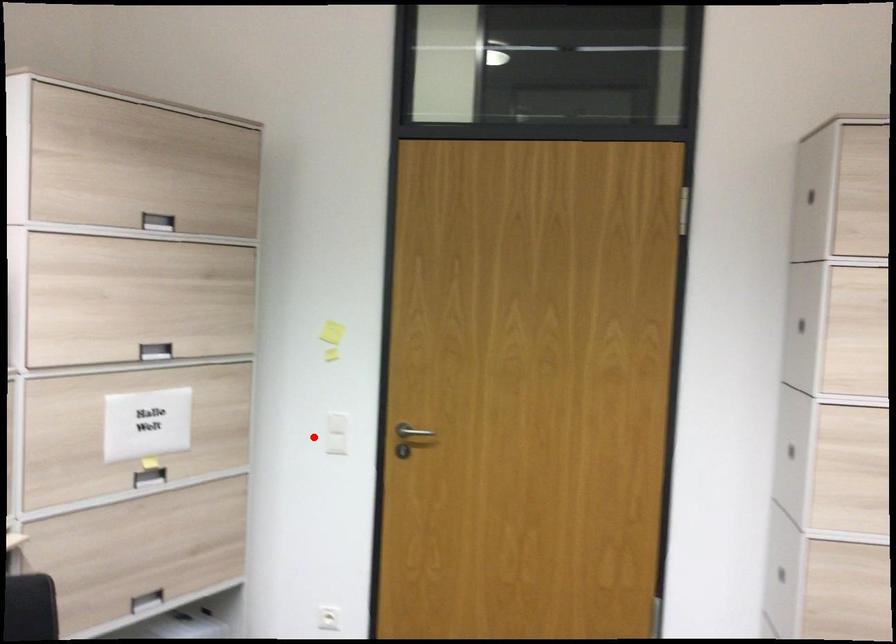
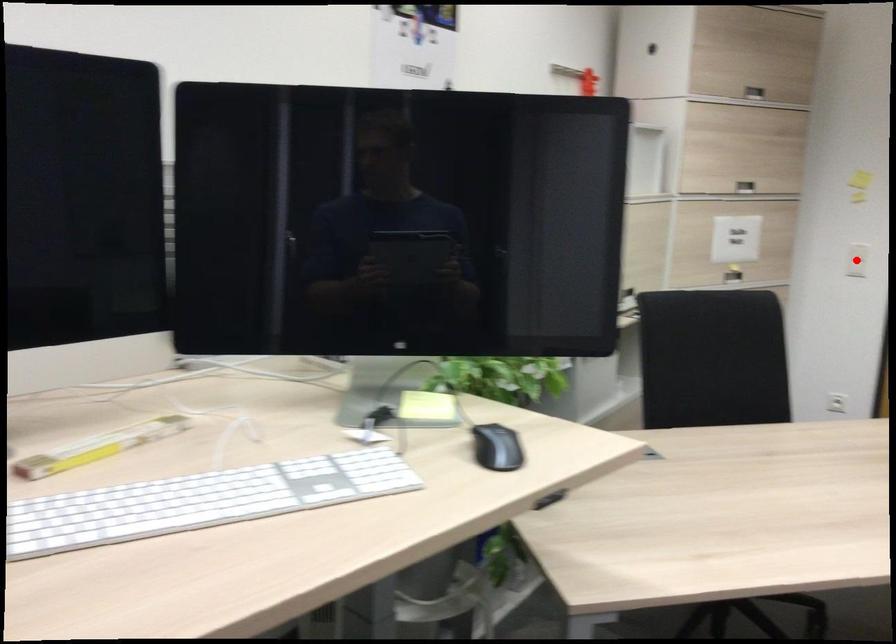
I am providing you with two images of the same scene from different viewpoints. A red point is marked on the first image and another point is marked on the second image. Is the red point in image1 aligned with the point shown in image2?

Yes